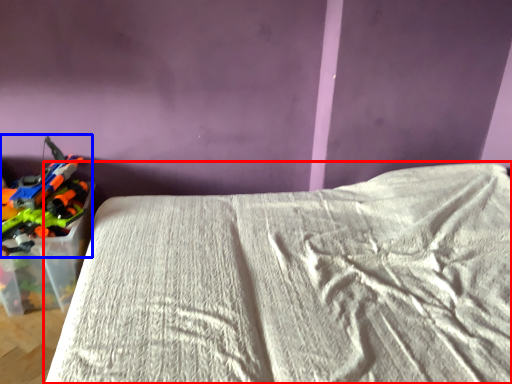
Question: Which point is further to the camera, bed (highlighted by a red box) or toy (highlighted by a blue box)?

Choices:
 (A) bed
 (B) toy

Answer: (B)